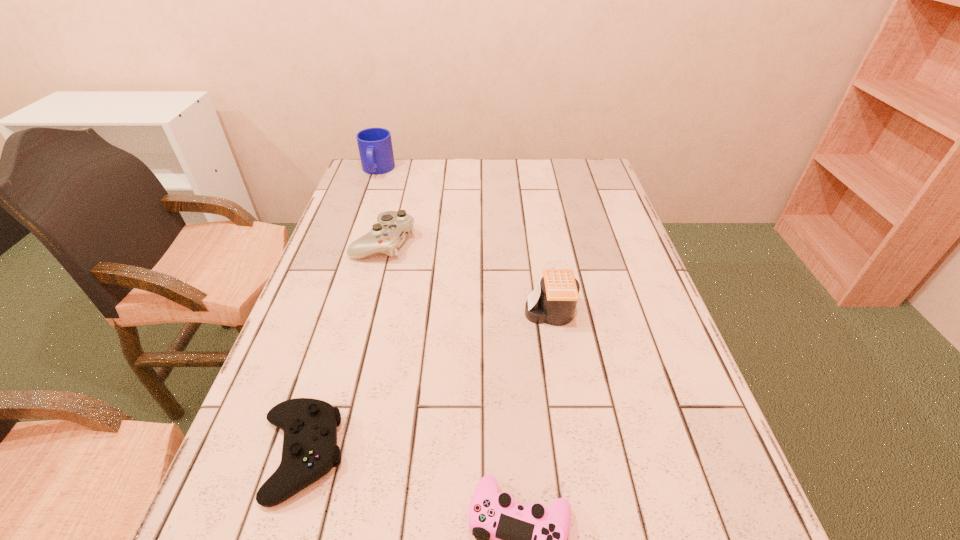
What are the coordinates of `mug positioned at the left edge` in the screenshot? It's located at (375, 147).

Locate an element on the screen. The height and width of the screenshot is (540, 960). object that is at the far left corner is located at coordinates (375, 147).

Image resolution: width=960 pixels, height=540 pixels. Identify the location of free spot at the far edge of the desktop. (451, 170).

In order to click on vacant space at the left edge of the desktop in this screenshot , I will do `click(310, 362)`.

The image size is (960, 540). I want to click on free space at the right edge of the desktop, so pyautogui.click(x=651, y=483).

The image size is (960, 540). In the image, there is a desktop. Identify the location of vacant area at the far right corner. (563, 162).

In order to click on vacant region between the tallest object and the farthest control in this screenshot , I will do `click(381, 206)`.

This screenshot has height=540, width=960. Find the location of `vacant area between the calculator and the farthest object`. vacant area between the calculator and the farthest object is located at coordinates (464, 241).

Where is `vacant region between the third nearest object and the mug`? vacant region between the third nearest object and the mug is located at coordinates (464, 241).

Identify which object is located as the nearest to the calculator. Please provide its 2D coordinates. Your answer should be formatted as a tuple, i.e. [(x, y)], where the tuple contains the x and y coordinates of a point satisfying the conditions above.

[(387, 235)]